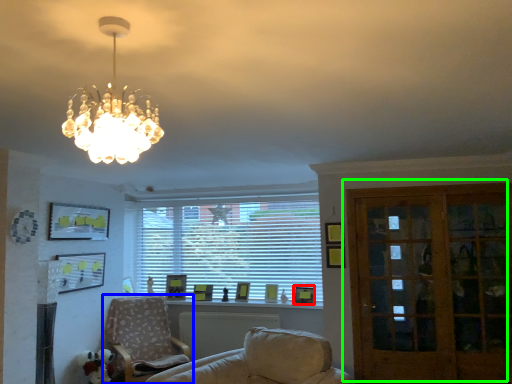
Question: Which object is the farthest from picture frame (highlighted by a red box)? Choose among these: chair (highlighted by a blue box) or door (highlighted by a green box).

Choices:
 (A) chair
 (B) door

Answer: (A)